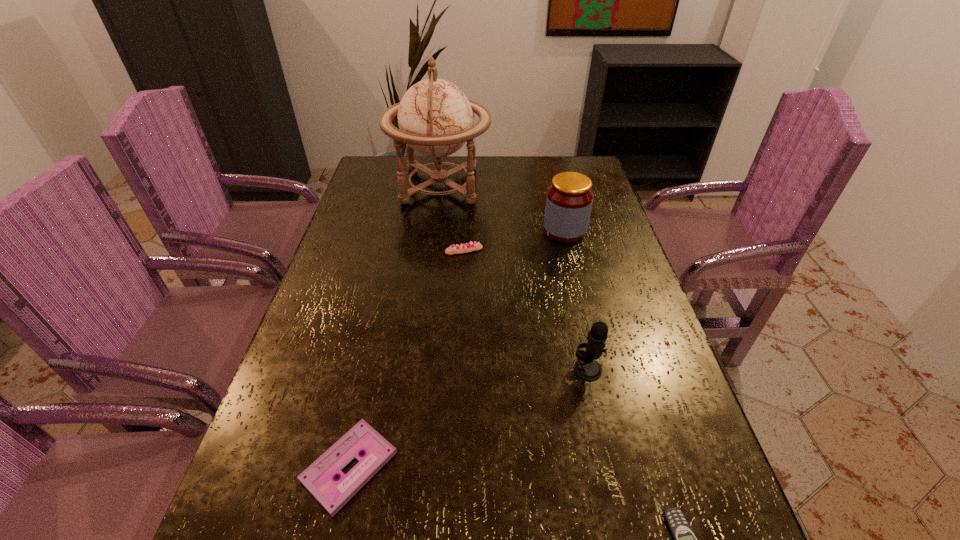
Locate an element on the screen. The width and height of the screenshot is (960, 540). blank space located on the back of the eclair is located at coordinates (466, 202).

Identify the location of vacant area located 0.180m on the right of the videotape. (495, 467).

Where is `object that is at the far edge`? The image size is (960, 540). object that is at the far edge is located at coordinates (435, 118).

Where is `globe that is at the left edge`? globe that is at the left edge is located at coordinates (435, 118).

Find the location of a particular element. videotape present at the left edge is located at coordinates coord(319,478).

This screenshot has width=960, height=540. In order to click on jar present at the right edge in this screenshot , I will do `click(569, 199)`.

This screenshot has height=540, width=960. I want to click on microphone located at the right edge, so click(586, 367).

Image resolution: width=960 pixels, height=540 pixels. Find the location of `object that is at the far left corner`. object that is at the far left corner is located at coordinates (435, 118).

You are a GUI agent. You are given a task and a screenshot of the screen. Output one action in this format:
    pyautogui.click(x=<x>, y=<y>)
    Task: Click on the vacant space at the far edge of the desktop
    This screenshot has width=960, height=540.
    Given the screenshot: What is the action you would take?
    [529, 160]

This screenshot has width=960, height=540. Identify the location of free space at the left edge of the desktop. (303, 437).